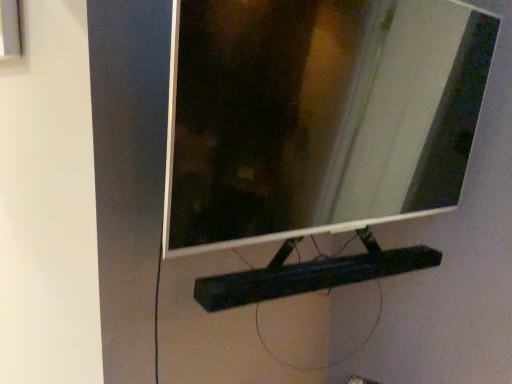
Locate an element on the screen. clear glass window at upper left is located at coordinates pyautogui.click(x=12, y=35).

What do you see at coordinates (12, 35) in the screenshot? I see `clear glass window at upper left` at bounding box center [12, 35].

Locate an element on the screen. This screenshot has width=512, height=384. clear glass window at upper left is located at coordinates (12, 35).